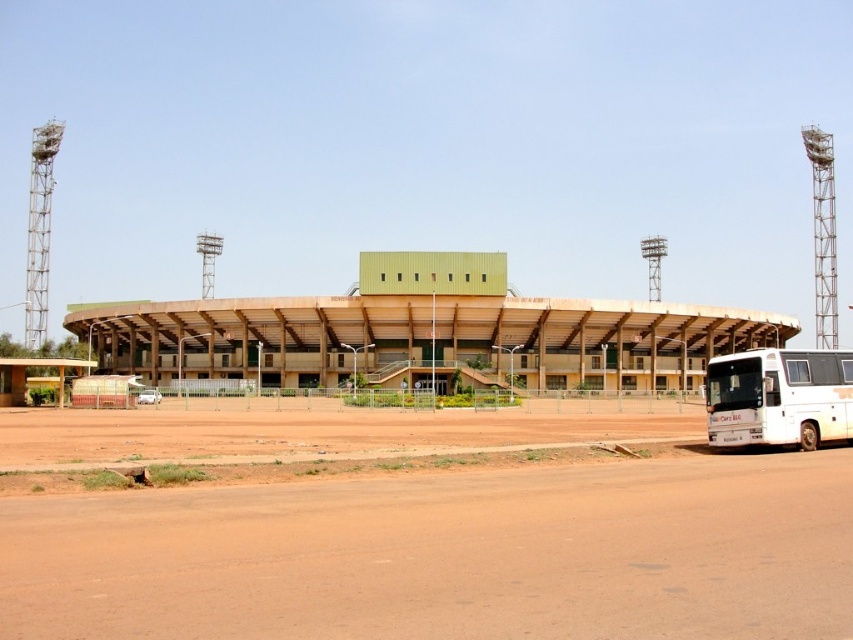
Question: Which of the following is the farthest from the observer?

Choices:
 (A) green matte stadium at center
 (B) white matte bus at lower right
 (C) brown dirt track at lower center

Answer: (A)

Question: Which of the following is the closest to the observer?

Choices:
 (A) (695, 611)
 (B) (171, 330)
 (C) (820, 400)

Answer: (A)

Question: Can you confirm if brown dirt track at lower center is positioned to the right of green matte stadium at center?

Choices:
 (A) yes
 (B) no

Answer: (A)

Question: Is brown dirt track at lower center thinner than white matte bus at lower right?

Choices:
 (A) no
 (B) yes

Answer: (A)

Question: Is brown dirt track at lower center behind green matte stadium at center?

Choices:
 (A) yes
 (B) no

Answer: (B)

Question: Which of these objects is positioned closest to the white matte bus at lower right?

Choices:
 (A) brown dirt track at lower center
 (B) green matte stadium at center

Answer: (A)